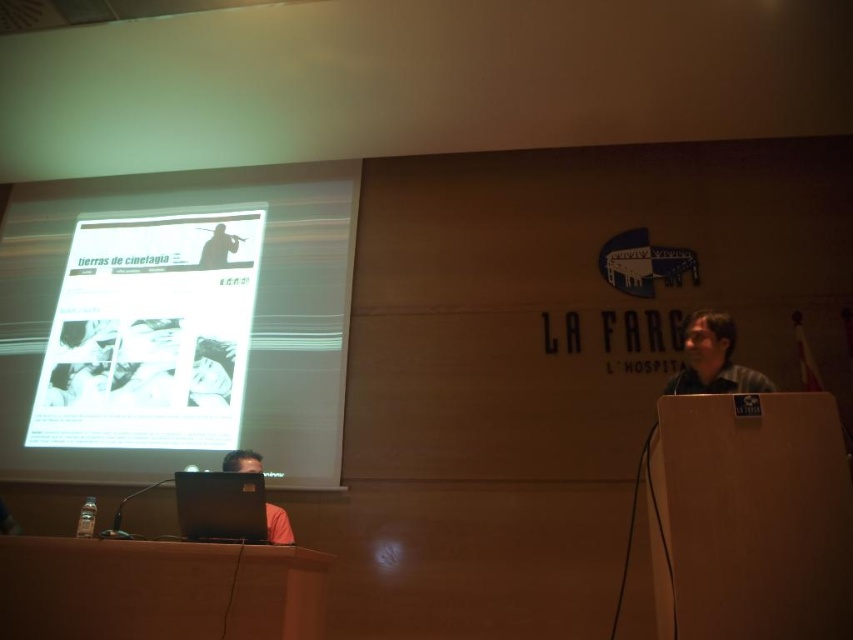
You are an attendee in the conference room. You see the matte gray shirt at right and the matte black laptop at upper left. Which object is positioned more to the east in the room?

The matte gray shirt at right is positioned more to the east in the room because it is to the right of the matte black laptop at upper left, and assuming the room is oriented with the screen at the front facing north, the right side would correspond to the east direction.

You are setting up for a presentation and need to place both the white matte projection screen at upper left and the matte black laptop at upper left on a table. Given their sizes, which one should you place first to ensure stability?

The white matte projection screen at upper left has a larger size compared to the matte black laptop at upper left, so you should place the white matte projection screen at upper left first to ensure stability.